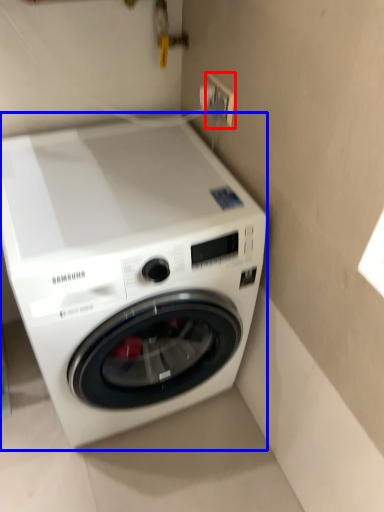
Question: Which object appears closest to the camera in this image, electric outlet (highlighted by a red box) or washing machine (highlighted by a blue box)?

Choices:
 (A) electric outlet
 (B) washing machine

Answer: (B)